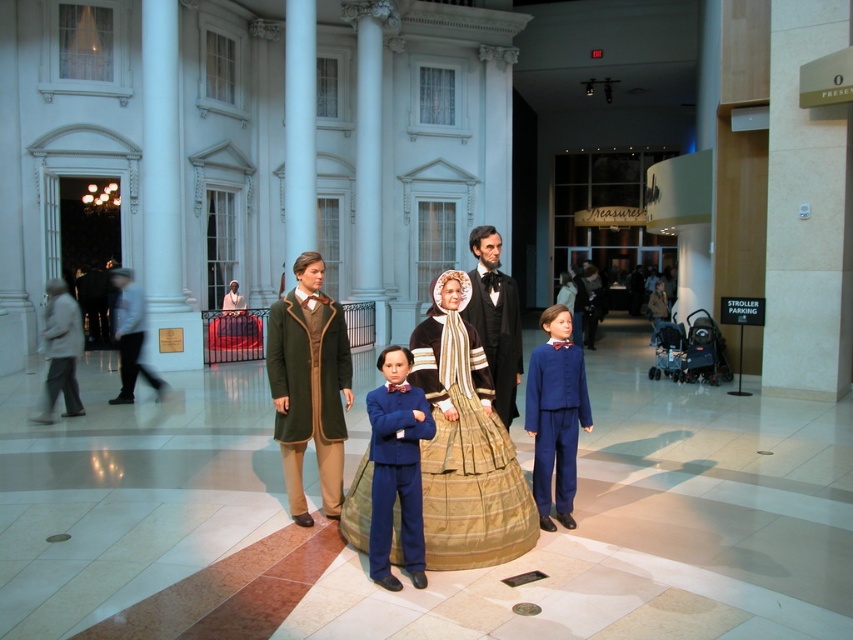
You are a museum visitor who wants to take a photo of both the matte brown suit at center and the blue fabric suit at center. Since you can only focus on one suit at a time, which one should you focus on first to ensure the other is still in the frame?

The matte brown suit at center is taller than the blue fabric suit at center, so you should focus on the taller matte brown suit at center first to ensure the shorter blue fabric suit at center remains in the frame.

You are a museum visitor who wants to take a photo of both the matte black suit at center and the blue wool suit at center. Since you can only focus on one suit at a time, which one should you choose to ensure the other is still visible in the background?

The matte black suit at center is smaller than the blue wool suit at center. Therefore, focusing on the blue wool suit at center will allow the smaller matte black suit at center to be visible in the background.

Based on the photo, you are standing at the entrance of the museum exhibit and want to take a photo of the blue fabric suit at center. The museum requires visitors to stay at least 1 meter away from all exhibits. Based on the coordinates provided, can you estimate if you can take the photo while maintaining the required distance?

The blue fabric suit at center is located at coordinates point [396,467]. Since the museum requires visitors to stay at least 1 meter away from exhibits, you need to ensure your position is at least 1 meter from these coordinates. However, without knowing the scale of the coordinate system or the actual dimensions of the exhibit space, it is impossible to accurately determine if the distance requirement is met. Please consult the museum staff for guidance on safe distances.